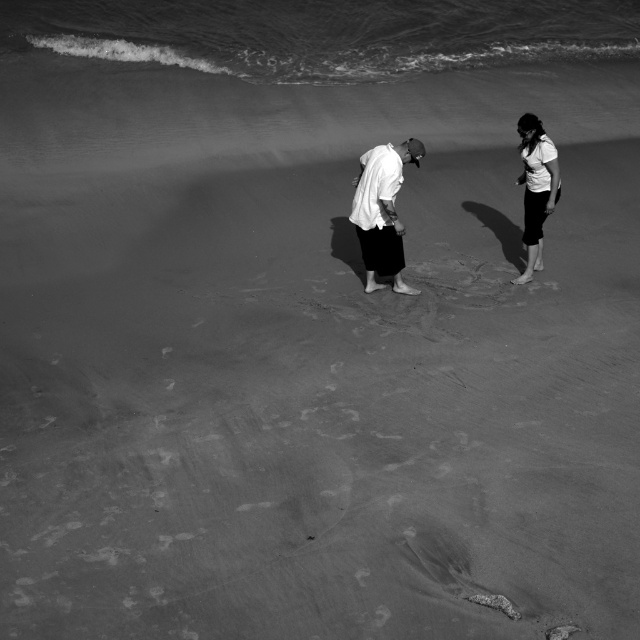
In the scene shown: Which is more to the right, white matte shirt at center or white cotton shirt at center?

Positioned to the right is white cotton shirt at center.

Is point (410, 148) behind point (552, 170)?

No.

Find the location of a particular element. The width and height of the screenshot is (640, 640). white matte shirt at center is located at coordinates (381, 211).

Does white cotton shirt at center appear under white matte shirt at right?

Yes.

Between point (365, 177) and point (525, 122), which one is positioned behind?

Point (525, 122)

Who is more distant from viewer, (525, 156) or (529, 179)?

Point (529, 179)

The height and width of the screenshot is (640, 640). Identify the location of white cotton shirt at center. (536, 188).

Between white matte shirt at center and white matte shirt at right, which one has less height?

With less height is white matte shirt at center.

The image size is (640, 640). Describe the element at coordinates (381, 211) in the screenshot. I see `white matte shirt at center` at that location.

Who is more forward, (400, 291) or (536, 124)?

Point (536, 124) is in front.

Find the location of `white matte shirt at center`. white matte shirt at center is located at coordinates (381, 211).